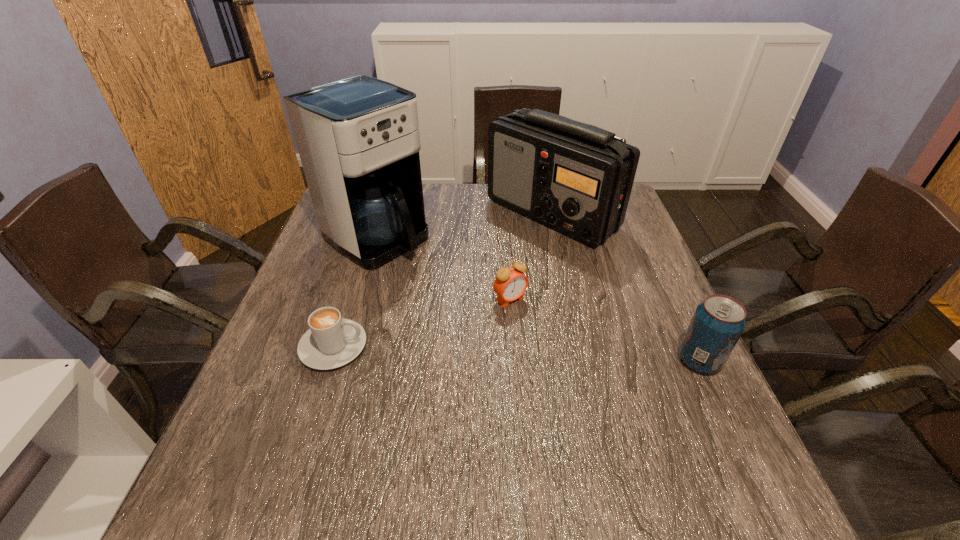
Image resolution: width=960 pixels, height=540 pixels. What are the coordinates of `free space between the fourth tallest object and the second tallest object` in the screenshot? It's located at (531, 256).

I want to click on empty space between the coffee maker and the cappuccino, so click(355, 292).

This screenshot has width=960, height=540. In order to click on empty location between the second tallest object and the tallest object in this screenshot , I will do `click(464, 225)`.

You are a GUI agent. You are given a task and a screenshot of the screen. Output one action in this format:
    pyautogui.click(x=<x>, y=<y>)
    Task: Click on the vacant point located between the radio receiver and the shortest object
    
    Given the screenshot: What is the action you would take?
    pyautogui.click(x=443, y=280)

The height and width of the screenshot is (540, 960). What are the coordinates of `free space between the third farthest object and the shortest object` in the screenshot? It's located at (421, 323).

The image size is (960, 540). Identify the location of vacant area that lies between the cappuccino and the tallest object. (355, 292).

Locate an element on the screen. This screenshot has width=960, height=540. free space between the radio receiver and the third nearest object is located at coordinates (531, 256).

This screenshot has width=960, height=540. I want to click on free spot between the radio receiver and the coffee maker, so click(464, 225).

Where is `free spot between the radio receiver and the coffee maker`? This screenshot has width=960, height=540. free spot between the radio receiver and the coffee maker is located at coordinates (464, 225).

Where is `vacant area that lies between the rightmost object and the coffee maker`? The width and height of the screenshot is (960, 540). vacant area that lies between the rightmost object and the coffee maker is located at coordinates (538, 299).